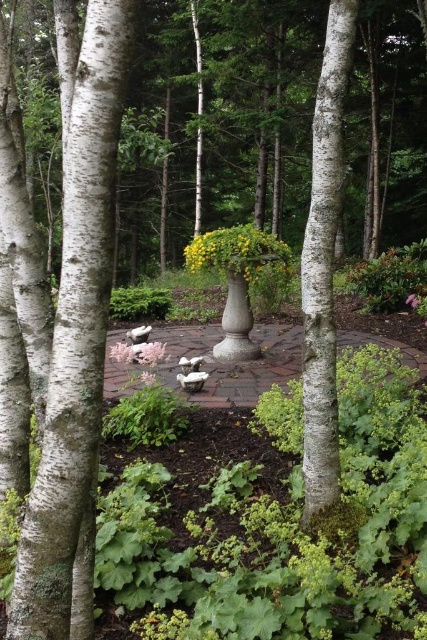
Which of these two, white matte flower at center or pink matte flower at center, stands taller?

Standing taller between the two is pink matte flower at center.

Can you confirm if white matte flower at center is shorter than pink matte flower at center?

Yes.

At what (x,y) coordinates should I click in order to perform the action: click on white matte flower at center. Please return your answer as a coordinate pair (x, y). The height and width of the screenshot is (640, 427). Looking at the image, I should click on (122, 353).

Does yellow matte flower at center lie behind pink matte flower at center?

No, it is not.

Is yellow matte flower at center thinner than pink matte flower at center?

In fact, yellow matte flower at center might be wider than pink matte flower at center.

Which is in front, point (249, 266) or point (412, 300)?

Point (249, 266) is in front.

At what (x,y) coordinates should I click in order to perform the action: click on yellow matte flower at center. Please return your answer as a coordinate pair (x, y). This screenshot has width=427, height=640. Looking at the image, I should click on (236, 250).

Is white smooth tree trunk at center above yellow matte flower at center?

No.

At what (x,y) coordinates should I click in order to perform the action: click on white smooth tree trunk at center. Please return your answer as a coordinate pair (x, y). Image resolution: width=427 pixels, height=640 pixels. Looking at the image, I should click on (76, 336).

The width and height of the screenshot is (427, 640). Identify the location of white smooth tree trunk at center. (76, 336).